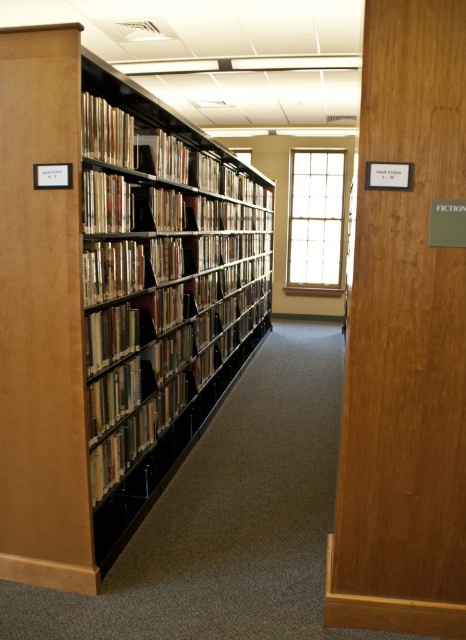
Does point (109, 90) lie behind point (105, 356)?

Yes, it is.

Is black metal bookshelf at left shorter than hardcover book at center?

No, black metal bookshelf at left is not shorter than hardcover book at center.

What do you see at coordinates (110, 298) in the screenshot?
I see `black metal bookshelf at left` at bounding box center [110, 298].

This screenshot has width=466, height=640. What are the coordinates of `black metal bookshelf at left` in the screenshot? It's located at (110, 298).